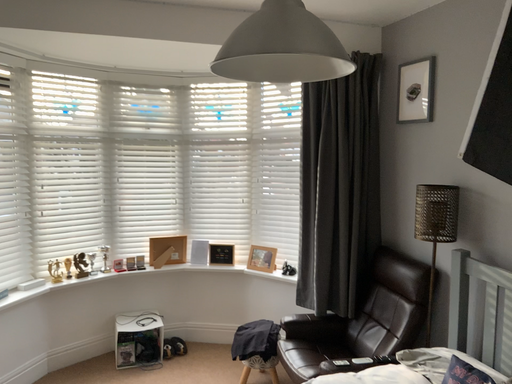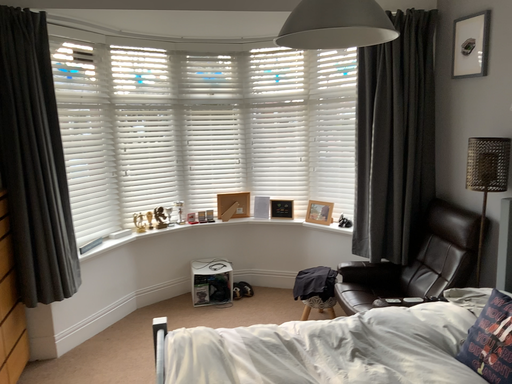
Question: How did the camera likely rotate when shooting the video?

Choices:
 (A) rotated right
 (B) rotated left

Answer: (B)